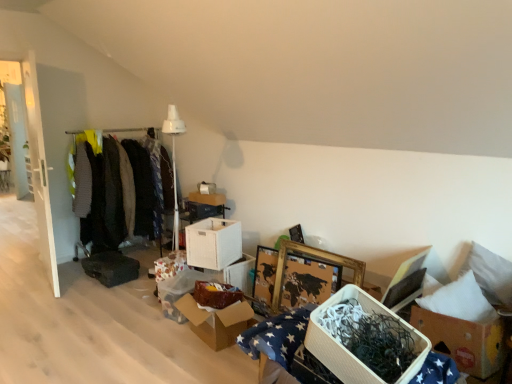
Locate an element on the screen. This screenshot has height=384, width=512. vacant space situated on the left part of matte cardboard box at center, the fifth storage box when ordered from back to front is located at coordinates coord(142,314).